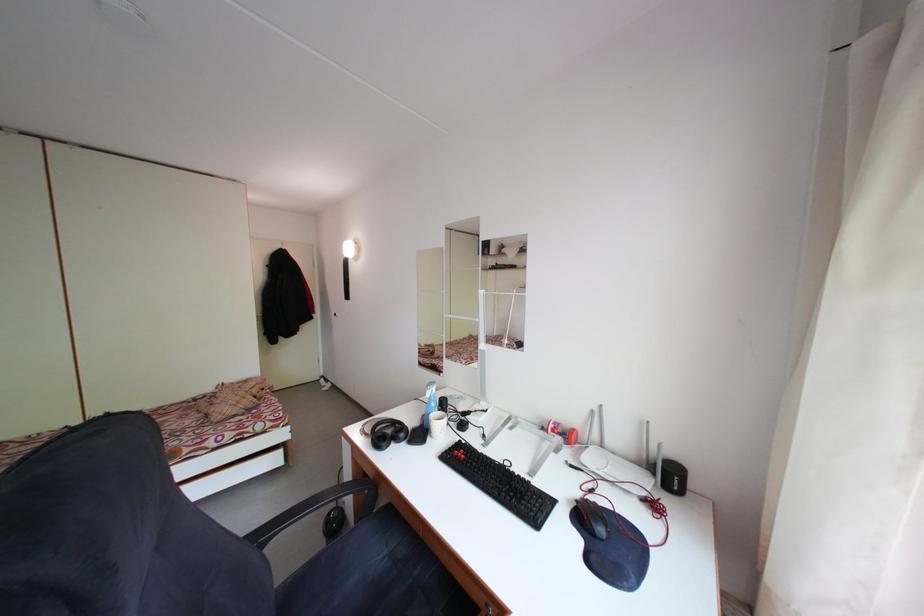
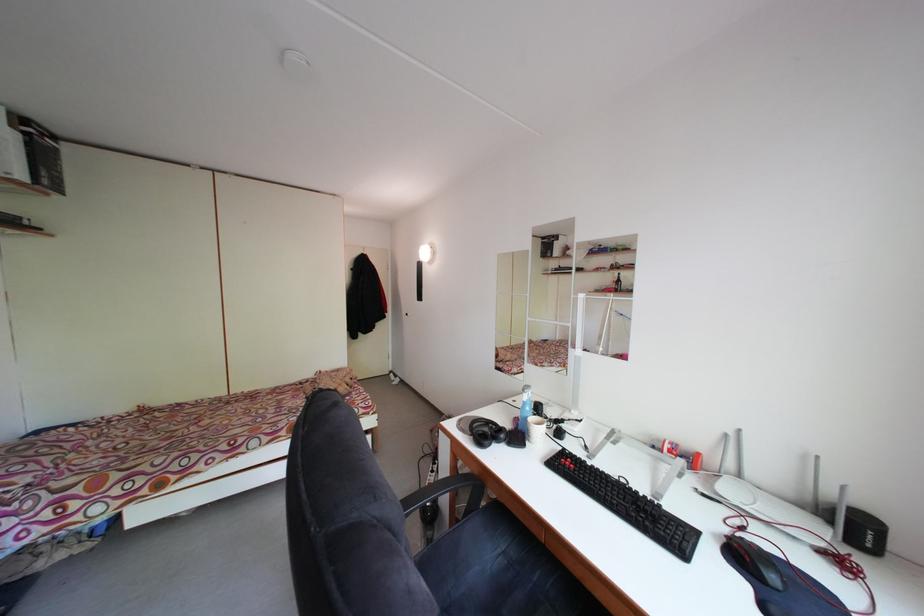
Locate, in the second image, the point that corresponds to point 601,418 in the first image.

(735, 442)